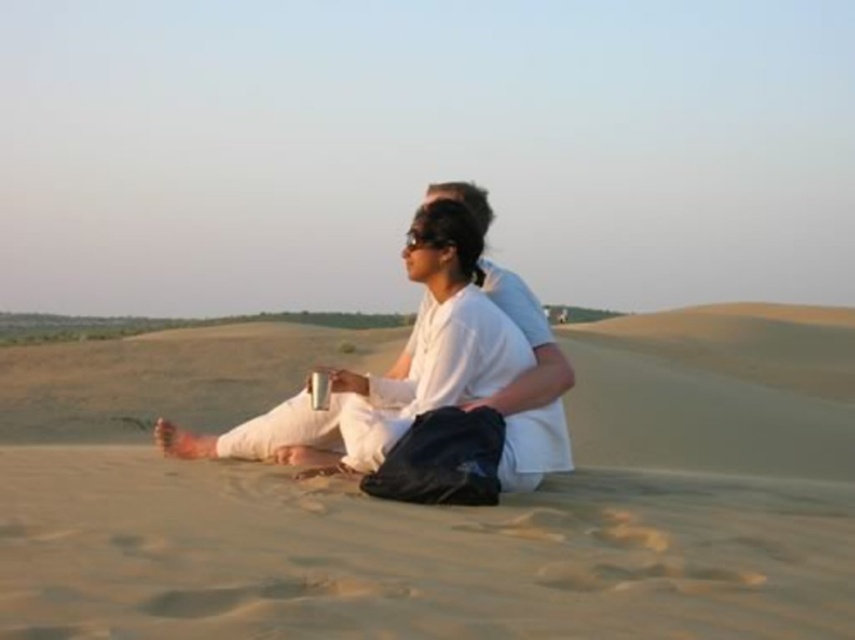
Question: Can you confirm if sandy beige sand at center is smaller than white matte clothing at center?

Choices:
 (A) yes
 (B) no

Answer: (B)

Question: Which of the following is the closest to the observer?

Choices:
 (A) white matte clothing at center
 (B) black matte goggles at center

Answer: (A)

Question: Which of the following is the closest to the observer?

Choices:
 (A) (346, 448)
 (B) (410, 243)
 (C) (852, 353)

Answer: (A)

Question: Can you confirm if white matte clothing at center is positioned below black matte goggles at center?

Choices:
 (A) no
 (B) yes

Answer: (B)

Question: Is sandy beige sand at center above white matte clothing at center?

Choices:
 (A) no
 (B) yes

Answer: (A)

Question: Which point appears closest to the camera in this image?

Choices:
 (A) (431, 312)
 (B) (404, 243)

Answer: (B)